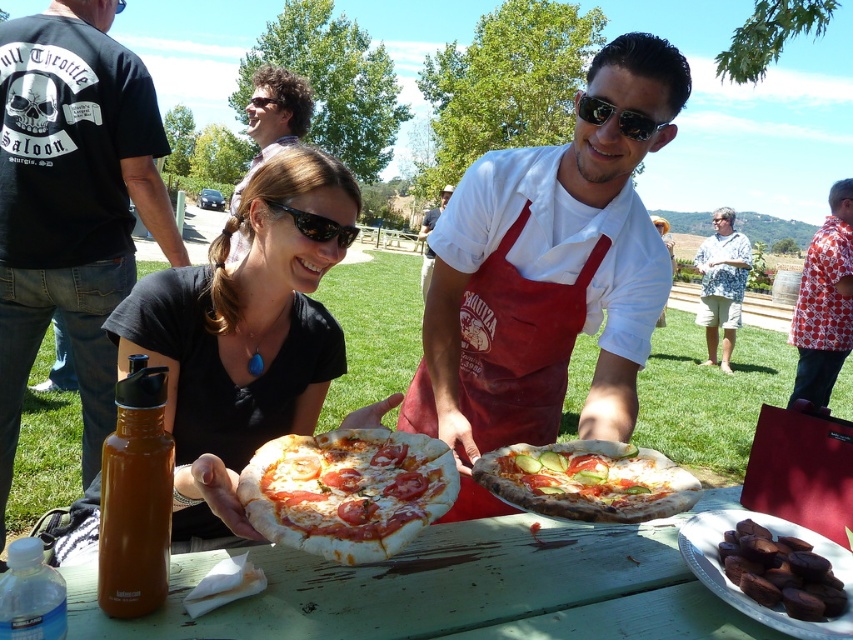
You are at a picnic and want to place a 10 cm wide object on the table. The dark chocolate at lower right and the white cotton shirt at upper center are already on the table. Which object has enough space for the new item next to it?

The white cotton shirt at upper center has enough space because it is wider than the dark chocolate at lower right, which is narrower and may not provide sufficient space for the 10 cm wide object.